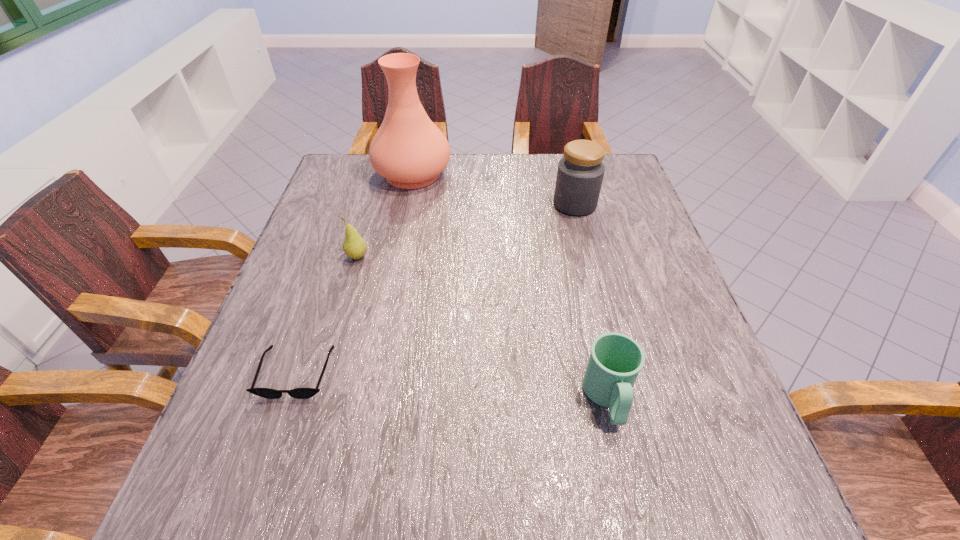
I want to click on vacant space located on the side of the mug with the handle, so click(627, 481).

The height and width of the screenshot is (540, 960). Find the location of `vacant space located on the front-facing side of the sunglasses`. vacant space located on the front-facing side of the sunglasses is located at coordinates (267, 459).

Locate an element on the screen. The width and height of the screenshot is (960, 540). vase that is at the far edge is located at coordinates [x=409, y=150].

Locate an element on the screen. This screenshot has height=540, width=960. jar situated at the far edge is located at coordinates (580, 173).

The height and width of the screenshot is (540, 960). Identify the location of vase positioned at the left edge. (409, 150).

Find the location of a particular element. The height and width of the screenshot is (540, 960). pear located in the left edge section of the desktop is located at coordinates (354, 246).

Image resolution: width=960 pixels, height=540 pixels. Identify the location of sunglasses located in the left edge section of the desktop. (300, 393).

Locate an element on the screen. The height and width of the screenshot is (540, 960). object that is at the right edge is located at coordinates (580, 173).

Where is `object located in the far left corner section of the desktop`? The width and height of the screenshot is (960, 540). object located in the far left corner section of the desktop is located at coordinates (409, 150).

Where is `object that is positioned at the far right corner`? This screenshot has width=960, height=540. object that is positioned at the far right corner is located at coordinates (580, 173).